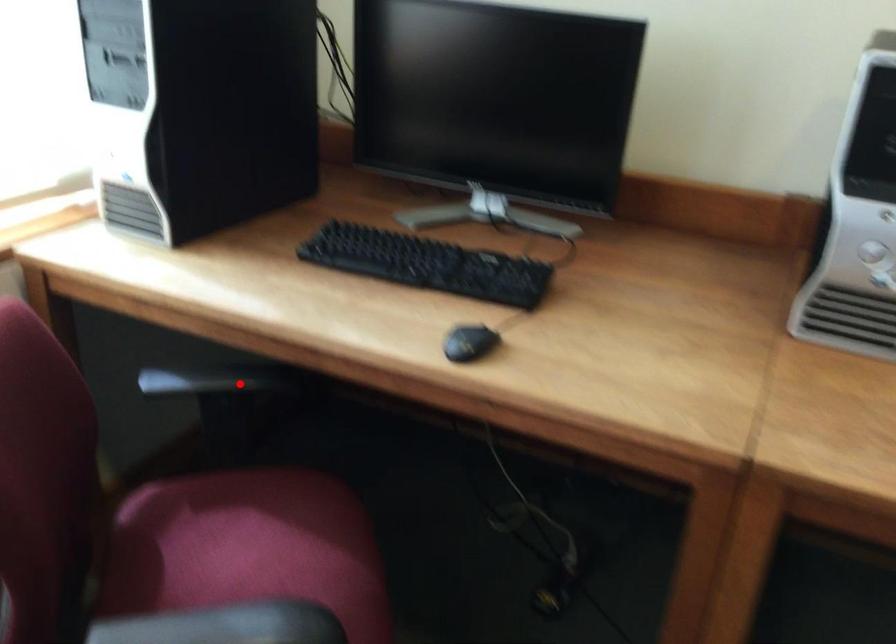
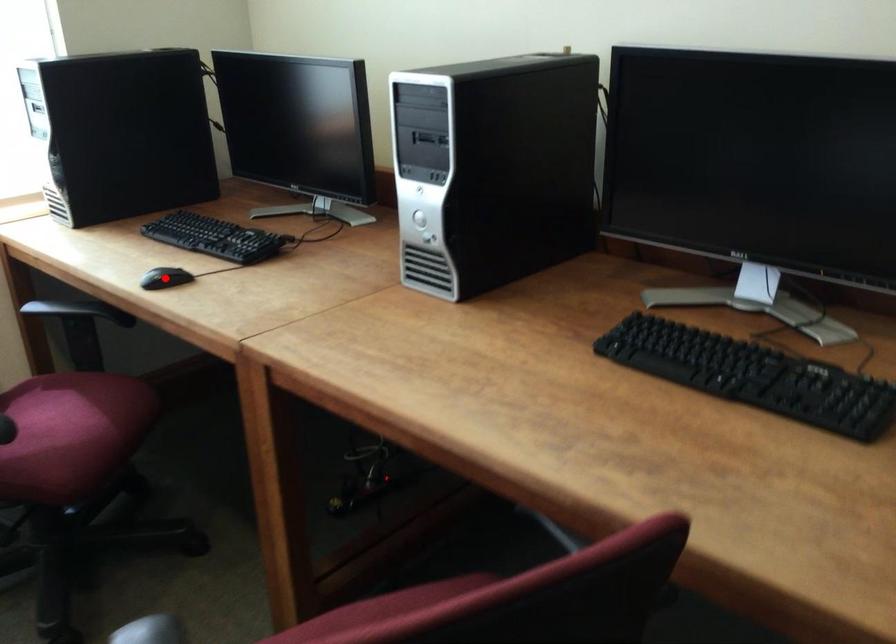
I am providing you with two images of the same scene from different viewpoints. A red point is marked on the first image and another point is marked on the second image. Is the red point in image1 aligned with the point shown in image2?

No